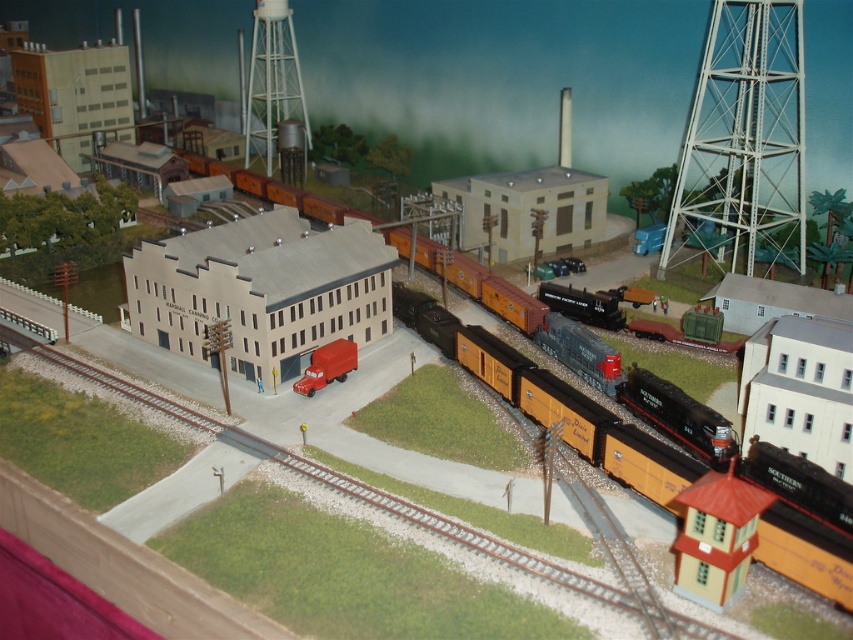
In the scene shown: Is white metallic water tower at upper right taller than orange matte freight car at center?

Indeed, white metallic water tower at upper right has a greater height compared to orange matte freight car at center.

Is white metallic water tower at upper right to the left of orange matte freight car at center from the viewer's perspective?

No, white metallic water tower at upper right is not to the left of orange matte freight car at center.

Is point (764, 259) positioned before point (670, 476)?

No, it is not.

The height and width of the screenshot is (640, 853). I want to click on white metallic water tower at upper right, so click(746, 140).

Who is more forward, (637, 465) or (343, 380)?

Point (637, 465)

Is orange matte freight car at center taller than matte red truck at center?

Yes, orange matte freight car at center is taller than matte red truck at center.

Who is more distant from viewer, (677, 438) or (350, 358)?

Point (350, 358)

The height and width of the screenshot is (640, 853). Identify the location of orange matte freight car at center. (715, 371).

Is metallic freight car at center below white matte water tower at upper center?

Yes, metallic freight car at center is below white matte water tower at upper center.

Does metallic freight car at center have a greater width compared to white matte water tower at upper center?

Indeed, metallic freight car at center has a greater width compared to white matte water tower at upper center.

Is point (444, 259) closer to viewer compared to point (270, 68)?

Yes, it is in front of point (270, 68).

You are a GUI agent. You are given a task and a screenshot of the screen. Output one action in this format:
    pyautogui.click(x=<x>, y=<y>)
    Task: Click on the metallic freight car at center
    
    Given the screenshot: What is the action you would take?
    pyautogui.click(x=467, y=276)